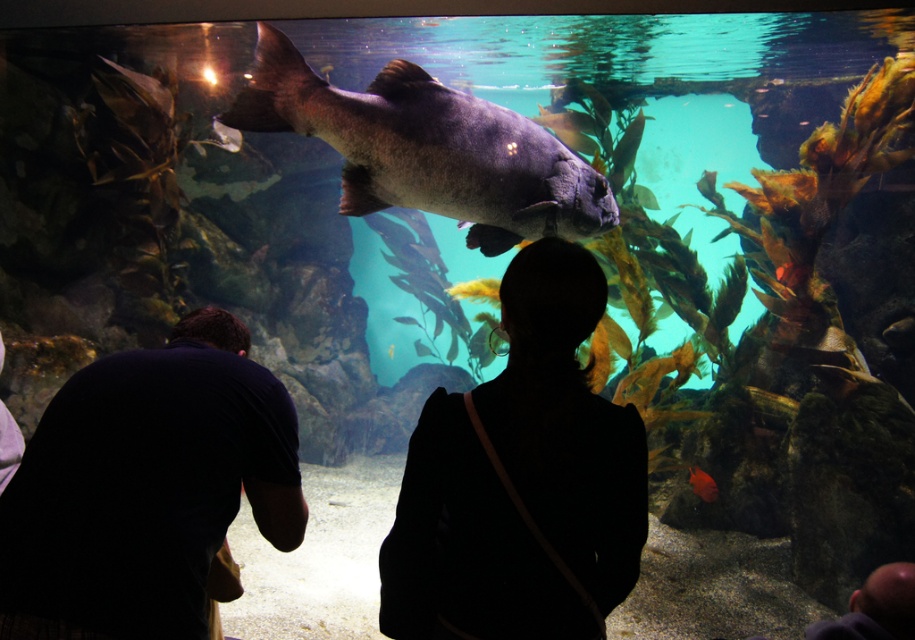
Is orange matte fish at center positioned at the back of shiny silver fish at center?

No, orange matte fish at center is closer to the viewer.

The width and height of the screenshot is (915, 640). Identify the location of orange matte fish at center. (702, 483).

Where is `orange matte fish at center`? The image size is (915, 640). orange matte fish at center is located at coordinates (702, 483).

Between dark blue shirt at lower left and shiny silver fish at center, which one appears on the right side from the viewer's perspective?

From the viewer's perspective, dark blue shirt at lower left appears more on the right side.

Is dark blue shirt at lower left taller than shiny silver fish at center?

Yes, dark blue shirt at lower left is taller than shiny silver fish at center.

Which is behind, point (62, 593) or point (401, 317)?

Positioned behind is point (401, 317).

This screenshot has width=915, height=640. Identify the location of dark blue shirt at lower left. [x=147, y=490].

Is point (544, 134) positioned after point (697, 490)?

That is False.

The width and height of the screenshot is (915, 640). In order to click on shiny dark blue fish at center in this screenshot , I will do `click(428, 148)`.